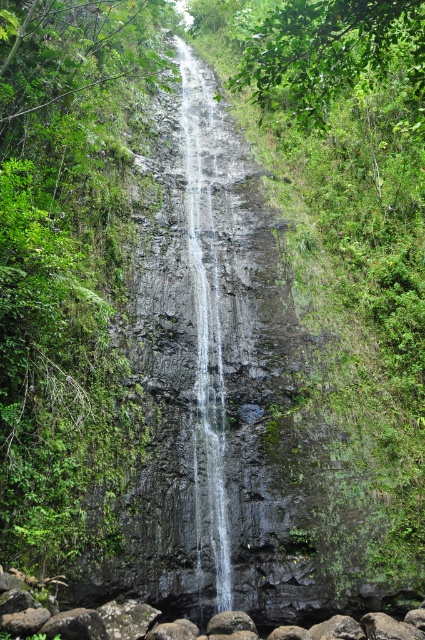
Looking at the waterfall scene, where is the clear water at center in relation to the smooth gray rock at center?

The clear water at center is located to the left of the smooth gray rock at center.